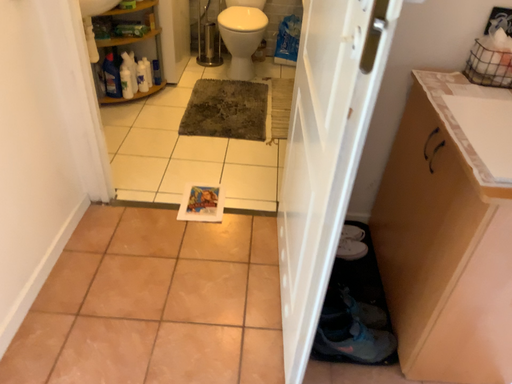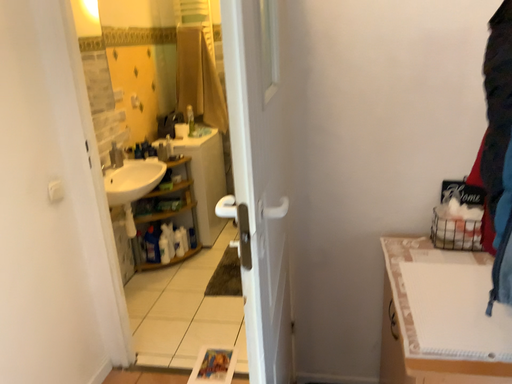
Question: How did the camera likely rotate when shooting the video?

Choices:
 (A) rotated right
 (B) rotated left

Answer: (B)